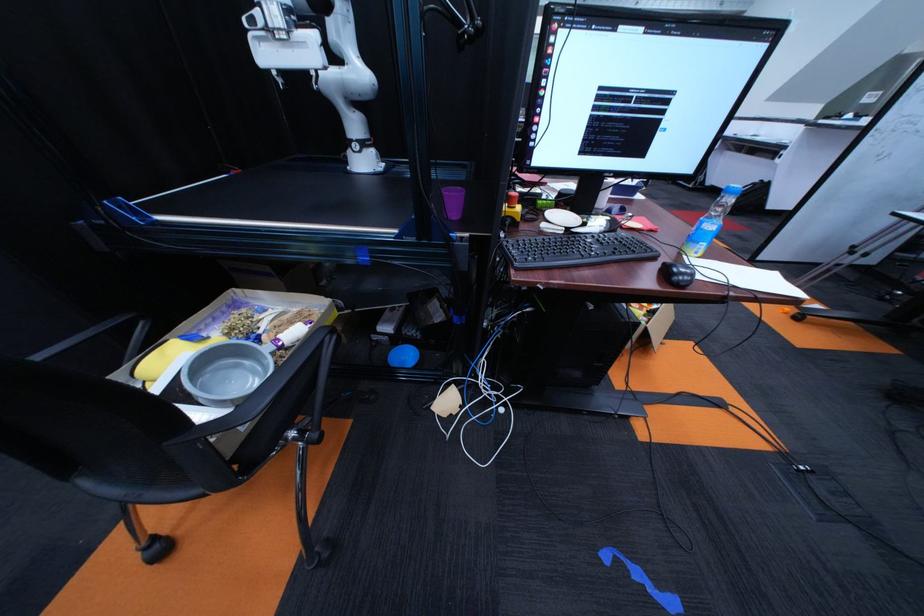
The location [167,355] corresponds to which object?

It corresponds to the yellow sponge in the image.